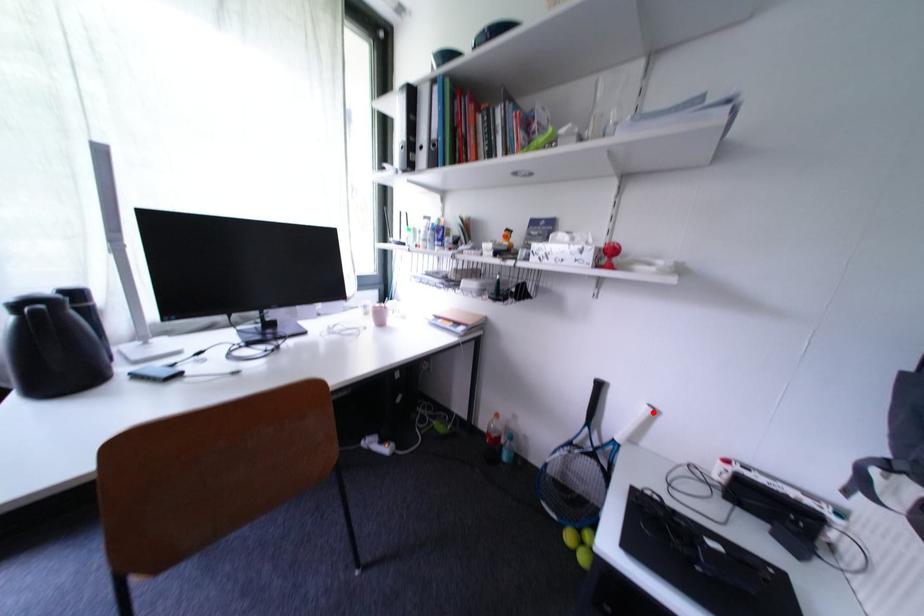
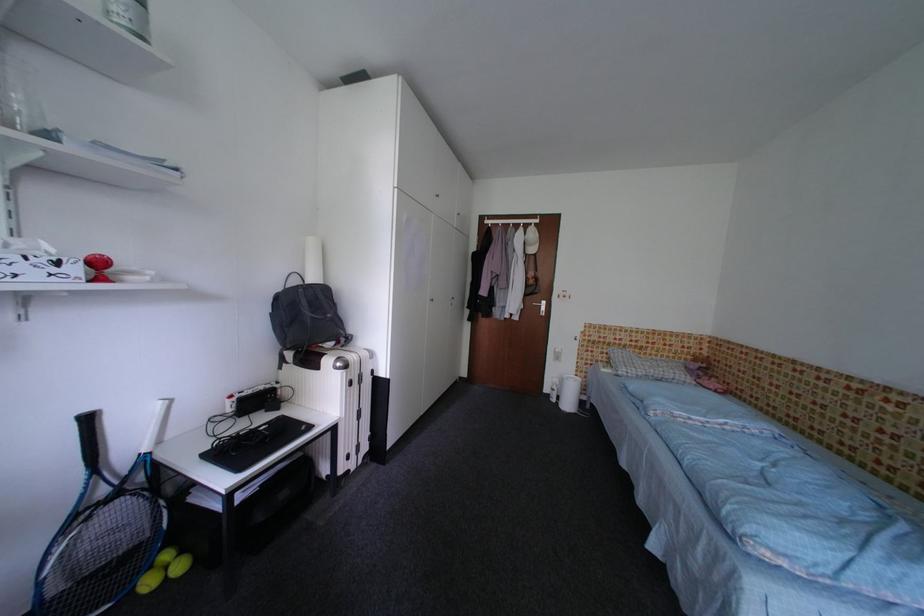
Find the pixel in the second image that matches the highlighted location in the first image.

(167, 408)